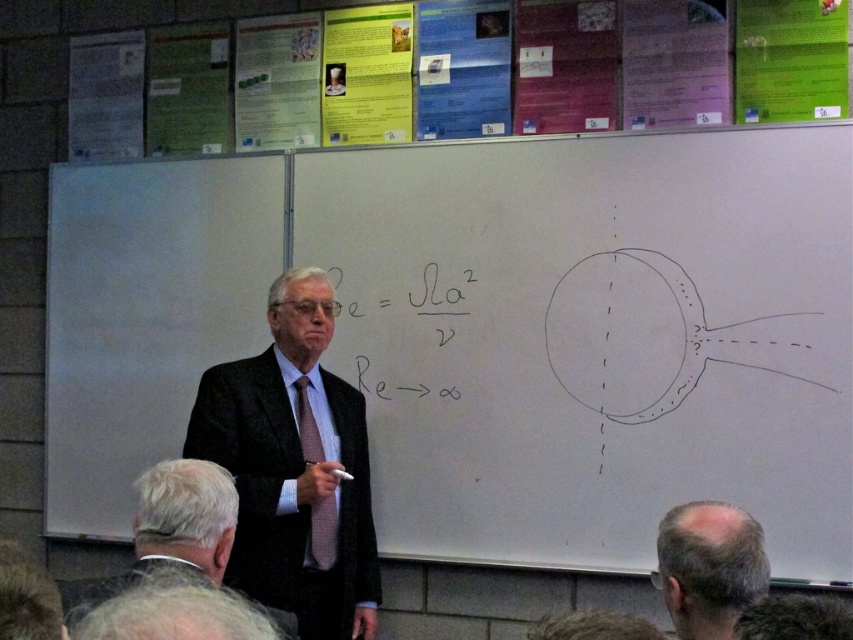
Who is shorter, black matte equation at center or dotted silk tie at center?

black matte equation at center

Is black matte equation at center to the left of dotted silk tie at center from the viewer's perspective?

No, black matte equation at center is not to the left of dotted silk tie at center.

Is point (387, 349) positioned after point (323, 524)?

That is True.

At what (x,y) coordinates should I click in order to perform the action: click on black matte equation at center. Please return your answer as a coordinate pair (x, y). The width and height of the screenshot is (853, 640). Looking at the image, I should click on (405, 330).

From the picture: Who is positioned more to the left, dark suit at center or dotted silk tie at center?

dark suit at center is more to the left.

Which of these two, dark suit at center or dotted silk tie at center, stands shorter?

Standing shorter between the two is dotted silk tie at center.

Which is behind, point (234, 381) or point (318, 499)?

Positioned behind is point (234, 381).

I want to click on dark suit at center, so click(x=294, y=467).

Is point (641, 241) positioned after point (693, 592)?

Yes, point (641, 241) is behind point (693, 592).

Does whiteboard at upper center appear on the right side of bald head at lower right?

Incorrect, whiteboard at upper center is not on the right side of bald head at lower right.

The width and height of the screenshot is (853, 640). What do you see at coordinates (595, 337) in the screenshot? I see `whiteboard at upper center` at bounding box center [595, 337].

The image size is (853, 640). Identify the location of whiteboard at upper center. (595, 337).